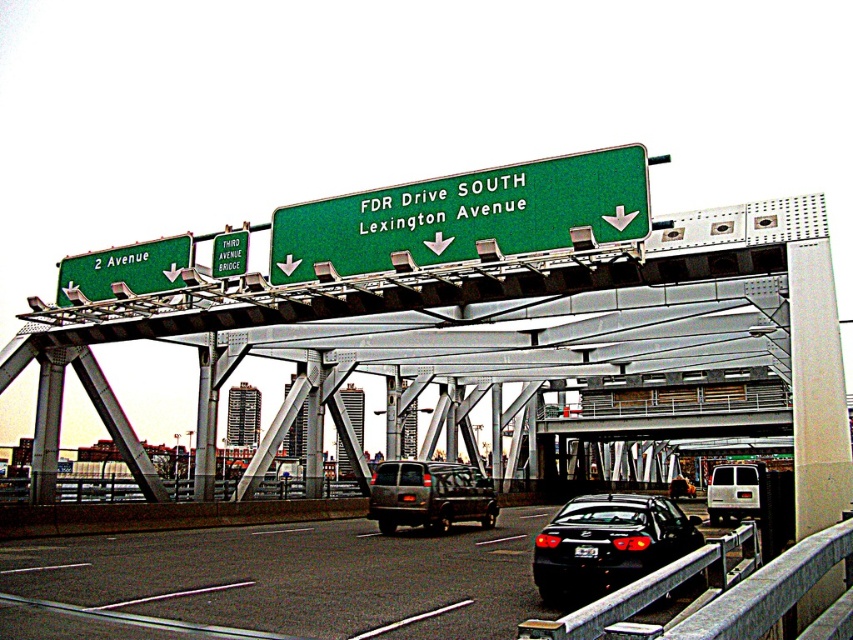
You are a driver approaching the overpass and need to decide whether to stop at the green matte sign at upper left or the white matte van at center first. Which object should you stop at first based on their positions?

The green matte sign at upper left is further to the viewer than the white matte van at center, so you should stop at the green matte sign at upper left first.

You are a driver approaching the overpass and need to choose between the green matte highway sign at center and the green matte sign at upper left. Which sign is placed higher above the road?

The green matte highway sign at center is positioned over the green matte sign at upper left, so it is higher above the road.

You are a driver approaching the highway overpass and need to locate the green matte sign at upper left. According to the scene description, where exactly is the green matte sign at upper left positioned relative to the point marked at coordinates (126, 268)?

The green matte sign at upper left is located exactly at the point marked by coordinates (126, 268).